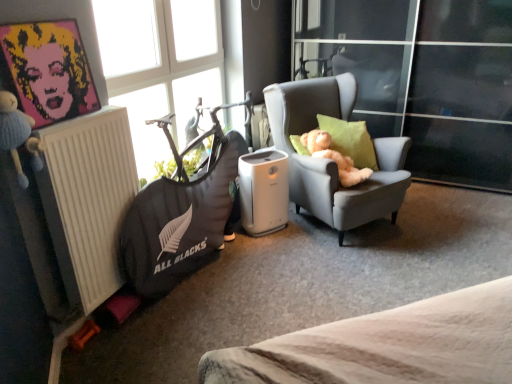
I want to click on white matte radiator at left, so click(88, 200).

What do you see at coordinates (331, 161) in the screenshot? This screenshot has height=384, width=512. I see `gray fabric armchair at center` at bounding box center [331, 161].

Image resolution: width=512 pixels, height=384 pixels. Identify the location of gray fabric armchair at center. (331, 161).

Identify the location of dark gray fabric bean bag at left. The width and height of the screenshot is (512, 384). (180, 223).

Locate an element on the screen. This screenshot has height=384, width=512. green fabric pillow at right is located at coordinates (350, 140).

From a real-world perspective, is pop art portrait of marilyn monroe at upper left positioned over transparent glass window at upper left based on gravity?

Indeed, from a real-world perspective, pop art portrait of marilyn monroe at upper left stands above transparent glass window at upper left.

Is transparent glass window at upper left at the back of pop art portrait of marilyn monroe at upper left?

pop art portrait of marilyn monroe at upper left is not turned away from transparent glass window at upper left.

Would you say pop art portrait of marilyn monroe at upper left contains transparent glass window at upper left?

No.

Can you confirm if dark gray fabric bean bag at left is bigger than gray fabric armchair at center?

No.

How many degrees apart are the facing directions of dark gray fabric bean bag at left and gray fabric armchair at center?

dark gray fabric bean bag at left and gray fabric armchair at center are facing 36.4 degrees away from each other.

Is dark gray fabric bean bag at left taller or shorter than gray fabric armchair at center?

Considering their sizes, dark gray fabric bean bag at left has less height than gray fabric armchair at center.

Considering the positions of objects dark gray fabric bean bag at left and gray fabric armchair at center in the image provided, who is more to the left, dark gray fabric bean bag at left or gray fabric armchair at center?

dark gray fabric bean bag at left.

Is dark gray fabric bean bag at left far away from green fabric pillow at right?

Absolutely, dark gray fabric bean bag at left is distant from green fabric pillow at right.

Who is shorter, dark gray fabric bean bag at left or green fabric pillow at right?

green fabric pillow at right is shorter.

From a real-world perspective, is dark gray fabric bean bag at left under green fabric pillow at right?

Yes, from a real-world perspective, dark gray fabric bean bag at left is under green fabric pillow at right.

Which is in front, point (225, 176) or point (118, 146)?

Positioned in front is point (118, 146).

Between dark gray fabric bean bag at left and white matte radiator at left, which one has larger width?

dark gray fabric bean bag at left is wider.

From a real-world perspective, between dark gray fabric bean bag at left and white matte radiator at left, who is vertically higher?

white matte radiator at left is physically above.

Is dark gray fabric bean bag at left beside white matte radiator at left?

No, dark gray fabric bean bag at left is not next to white matte radiator at left.

From the picture: Is white matte radiator at left to the right of pop art portrait of marilyn monroe at upper left from the viewer's perspective?

Yes, white matte radiator at left is to the right of pop art portrait of marilyn monroe at upper left.

Does white matte radiator at left touch pop art portrait of marilyn monroe at upper left?

They are not placed beside each other.

Could pop art portrait of marilyn monroe at upper left be considered to be inside white matte radiator at left?

No, pop art portrait of marilyn monroe at upper left is not surrounded by white matte radiator at left.

Can you confirm if green fabric pillow at right is thinner than gray fabric armchair at center?

Indeed, green fabric pillow at right has a lesser width compared to gray fabric armchair at center.

Is green fabric pillow at right closer to the viewer compared to gray fabric armchair at center?

No, green fabric pillow at right is behind gray fabric armchair at center.

Based on their sizes in the image, would you say green fabric pillow at right is bigger or smaller than gray fabric armchair at center?

Clearly, green fabric pillow at right is smaller in size than gray fabric armchair at center.

Which is behind, point (189, 49) or point (395, 195)?

The point (189, 49) is behind.

Is transparent glass window at upper left positioned far away from gray fabric armchair at center?

No.

Could you tell me if transparent glass window at upper left is facing gray fabric armchair at center?

Yes.

At what (x,y) coordinates should I click in order to perform the action: click on window directly beneath the pop art portrait of marilyn monroe at upper left (from a real-world perspective). Please return your answer as a coordinate pair (x, y). Looking at the image, I should click on (160, 66).

Where is `chair to the right of dark gray fabric bean bag at left`? chair to the right of dark gray fabric bean bag at left is located at coordinates (331, 161).

Looking at the image, which one is located further to transparent glass window at upper left, white matte radiator at left or dark gray fabric bean bag at left?

white matte radiator at left is positioned further to the anchor transparent glass window at upper left.

Estimate the real-world distances between objects in this image. Which object is further from green fabric pillow at right, white matte radiator at left or pop art portrait of marilyn monroe at upper left?

pop art portrait of marilyn monroe at upper left.

Which object lies further to the anchor point white matte radiator at left, pop art portrait of marilyn monroe at upper left or transparent glass window at upper left?

Among the two, transparent glass window at upper left is located further to white matte radiator at left.

Which object lies nearer to the anchor point white matte radiator at left, dark gray fabric bean bag at left or transparent glass window at upper left?

Among the two, dark gray fabric bean bag at left is located nearer to white matte radiator at left.

Considering their positions, is white matte radiator at left positioned further to pop art portrait of marilyn monroe at upper left than dark gray fabric bean bag at left?

Based on the image, dark gray fabric bean bag at left appears to be further to pop art portrait of marilyn monroe at upper left.

Based on their spatial positions, is pop art portrait of marilyn monroe at upper left or green fabric pillow at right further from white matte radiator at left?

green fabric pillow at right is positioned further to the anchor white matte radiator at left.

When comparing their distances from green fabric pillow at right, does gray fabric armchair at center or pop art portrait of marilyn monroe at upper left seem further?

pop art portrait of marilyn monroe at upper left is positioned further to the anchor green fabric pillow at right.

From the image, which object appears to be nearer to pop art portrait of marilyn monroe at upper left, dark gray fabric bean bag at left or gray fabric armchair at center?

The object closer to pop art portrait of marilyn monroe at upper left is dark gray fabric bean bag at left.

What are the coordinates of `person that lies between transparent glass window at upper left and white matte radiator at left from top to bottom` in the screenshot? It's located at (47, 70).

Locate an element on the screen. bean bag chair located between transparent glass window at upper left and gray fabric armchair at center in the left-right direction is located at coordinates (180, 223).

Where is `bean bag chair between pop art portrait of marilyn monroe at upper left and green fabric pillow at right`? The image size is (512, 384). bean bag chair between pop art portrait of marilyn monroe at upper left and green fabric pillow at right is located at coordinates (180, 223).

The image size is (512, 384). I want to click on bean bag chair between transparent glass window at upper left and green fabric pillow at right in the horizontal direction, so click(180, 223).